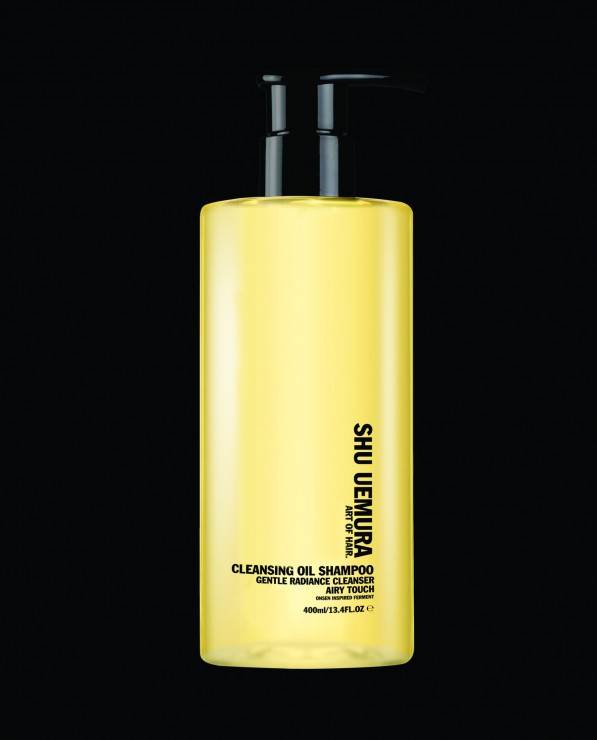
The image size is (597, 740). Identify the location of bottle plastic. (252, 426).